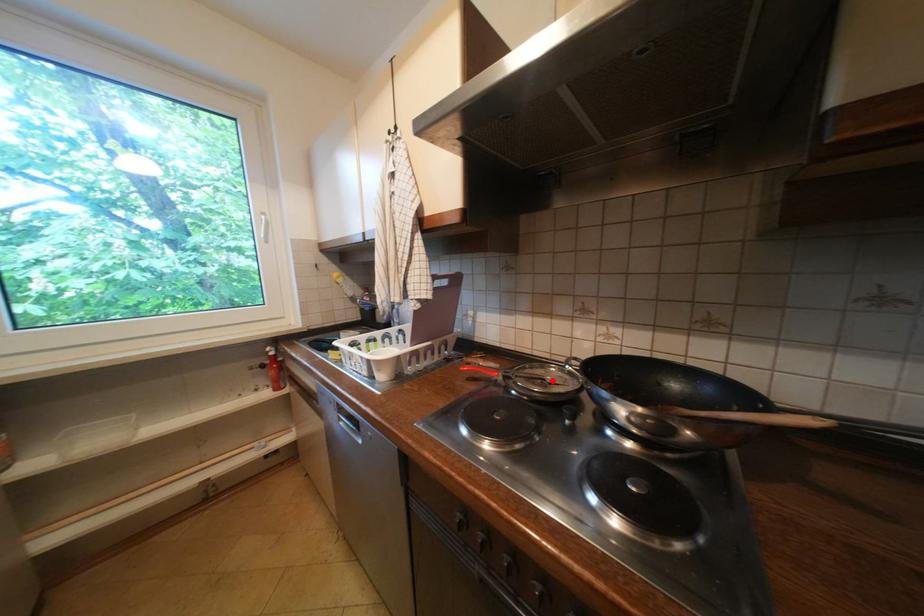
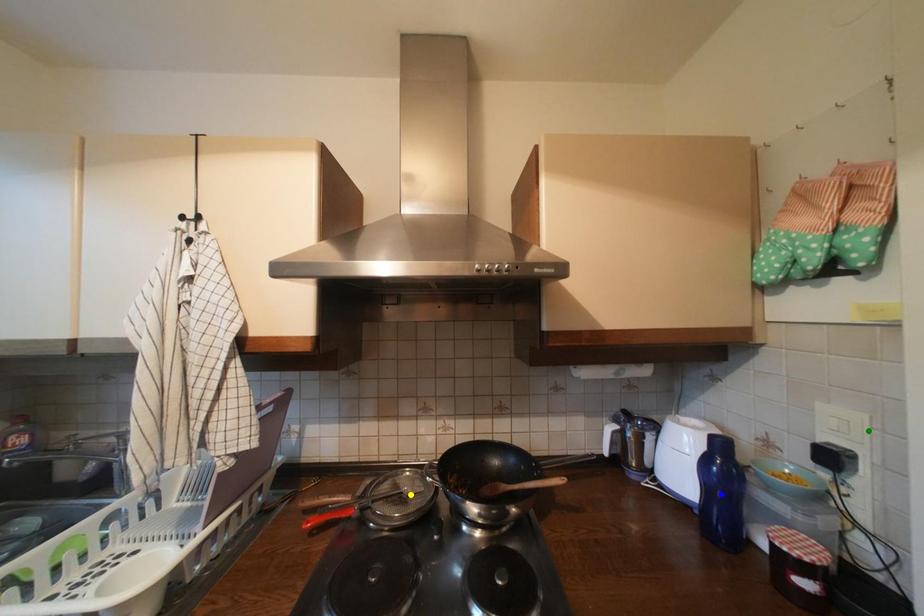
Question: I am providing you with two images of the same scene from different viewpoints. A red point is marked on the first image. You are given multiple points on the second image. In image 2, which mark is for the same physical point as the one in image 1?

Choices:
 (A) green point
 (B) blue point
 (C) yellow point

Answer: (C)